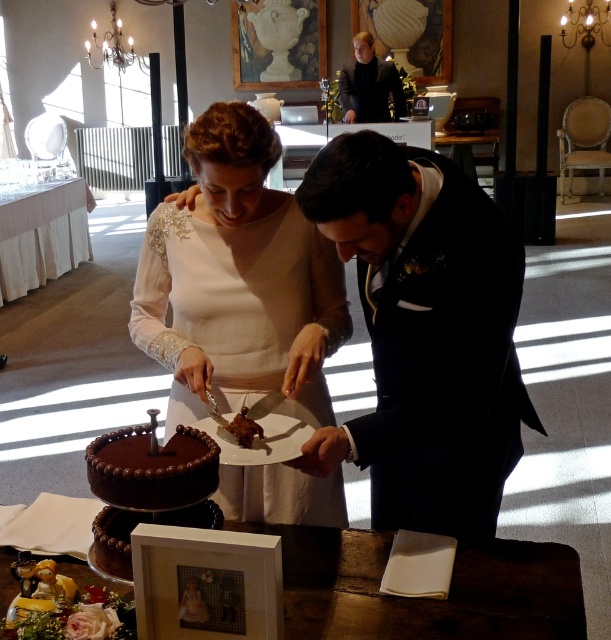
Is point (492, 337) less distant than point (293, 241)?

Yes, it is in front of point (293, 241).

This screenshot has height=640, width=611. Describe the element at coordinates (425, 333) in the screenshot. I see `black satin suit at center` at that location.

The height and width of the screenshot is (640, 611). Describe the element at coordinates (425, 333) in the screenshot. I see `black satin suit at center` at that location.

Locate an element on the screen. The image size is (611, 640). black satin suit at center is located at coordinates (425, 333).

Between wooden table at center and chocolatesmoothwedding cake at center, which one has less height?

With less height is wooden table at center.

Does wooden table at center appear on the left side of chocolatesmoothwedding cake at center?

Incorrect, wooden table at center is not on the left side of chocolatesmoothwedding cake at center.

Does point (483, 580) come behind point (174, 448)?

That is True.

Where is `wooden table at center`? This screenshot has width=611, height=640. wooden table at center is located at coordinates (425, 598).

Who is taller, wooden table at center or white matte picture frame at lower center?

With more height is white matte picture frame at lower center.

Is point (302, 634) less distant than point (167, 560)?

No, (302, 634) is further to viewer.

This screenshot has height=640, width=611. Identify the location of wooden table at center. (425, 598).